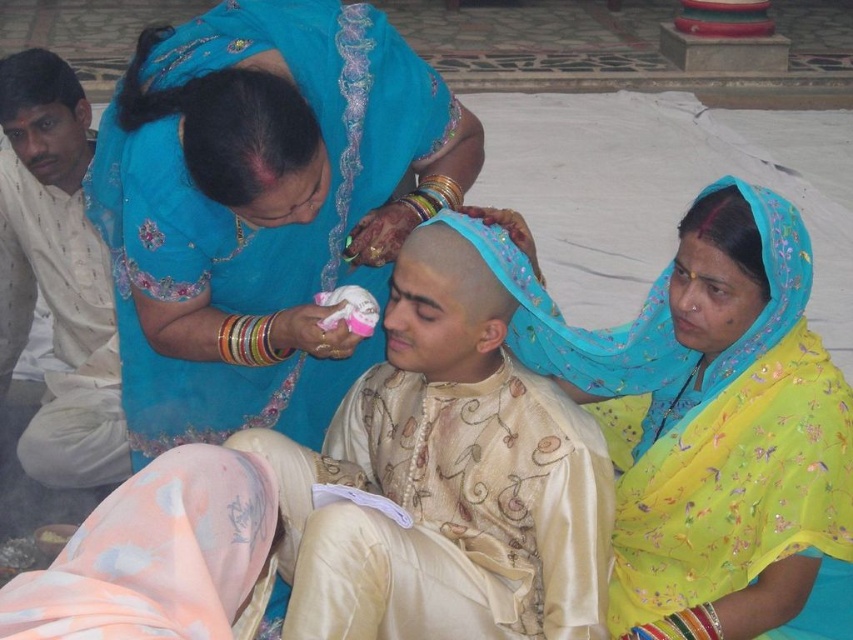
You are a photographer at the ceremony and want to capture both the blue silk saree at upper left and the yellow floral saree at center in the same frame. Which saree should you focus on to ensure both are visible without zooming in or out?

The blue silk saree at upper left is much taller than the yellow floral saree at center, so focusing on the taller blue silk saree at upper left would ensure both are visible without adjusting the zoom.

You are an event planner organizing a cultural exhibition and need to display two traditional Indian garments. The garments are the blue silk saree at upper left and the matte blue saree at left. Which garment should you place in a larger display case to accurately represent their sizes?

The blue silk saree at upper left should be placed in a larger display case because it is bigger than the matte blue saree at left.

You are a photographer at the ceremony. You need to take a photo of both the woman in the blue saree and the man in the beige kurta. The woman is at point (x=190, y=113) and the man is at point (x=68, y=419). To ensure both subjects are in focus, you want to know which subject is closer to the camera. Which point is closer to the camera?

Point (x=190, y=113) is in front of point (x=68, y=419), so the woman at point (x=190, y=113) is closer to the camera than the man at point (x=68, y=419).